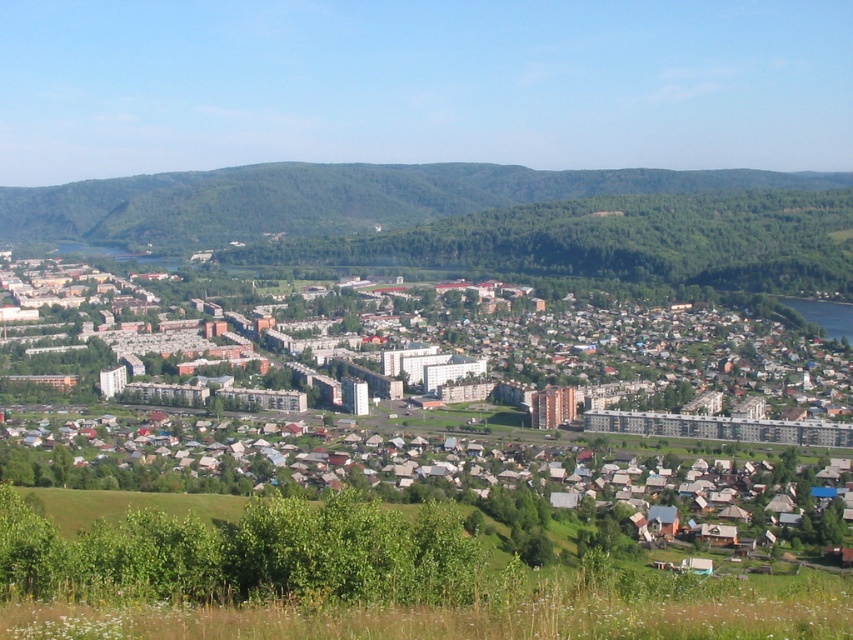
You are standing at the base of the green forested mountain at upper center and want to reach the multicolored residential buildings at center. Given that the average walking speed is 3 miles per hour, how many minutes would it take to walk there?

The multicolored residential buildings at center are 313.12 feet away from the green forested mountain at upper center. Converting feet to miles, 313.12 feet is approximately 0.06 miles. At a walking speed of 3 mph, it would take roughly 0.06 miles divided by 3 mph equals 0.02 hours, which is about 1.2 minutes. So, it would take approximately 1 minute to walk there.

You are standing at point A, which is located at coordinates 0.3, 0.3. You want to walk to the multicolored residential buildings at center. Which direction should you move in? Please provide your answer in terms of compass directions and distance in meters. Assume the image is 1m x 1m.

The multicolored residential buildings at center are located at point [466,417]. From point A at [254,192], you should move northeast for approximately 0.4 meters to reach them.